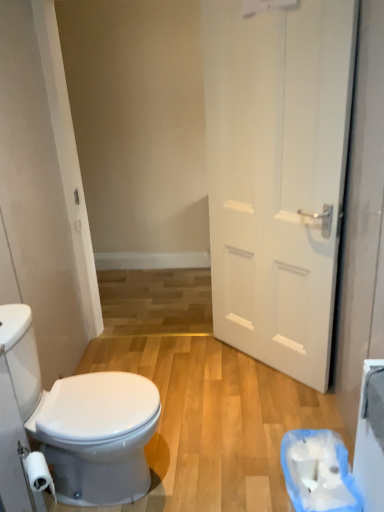
Question: From the image's perspective, is white matte toilet paper at lower left, arranged as the 2th toilet paper when viewed from the back, above white paper at lower right, acting as the first toilet paper starting from the right?

Choices:
 (A) no
 (B) yes

Answer: (B)

Question: Is white matte toilet paper at lower left, arranged as the 2th toilet paper when viewed from the back, outside of white paper at lower right, which is counted as the 1th toilet paper, starting from the back?

Choices:
 (A) yes
 (B) no

Answer: (A)

Question: From a real-world perspective, is white matte toilet paper at lower left, the first toilet paper when ordered from left to right, on top of white paper at lower right, acting as the first toilet paper starting from the right?

Choices:
 (A) yes
 (B) no

Answer: (A)

Question: Can you see white matte toilet paper at lower left, which appears as the 1th toilet paper when viewed from the front, touching white paper at lower right, acting as the first toilet paper starting from the right?

Choices:
 (A) no
 (B) yes

Answer: (A)

Question: Considering the relative sizes of white matte toilet paper at lower left, arranged as the 2th toilet paper when viewed from the back, and white paper at lower right, acting as the first toilet paper starting from the right, in the image provided, is white matte toilet paper at lower left, arranged as the 2th toilet paper when viewed from the back, bigger than white paper at lower right, acting as the first toilet paper starting from the right,?

Choices:
 (A) no
 (B) yes

Answer: (A)

Question: Does white matte toilet paper at lower left, arranged as the 2th toilet paper when viewed from the back, have a lesser width compared to white paper at lower right, acting as the first toilet paper starting from the right?

Choices:
 (A) no
 (B) yes

Answer: (B)

Question: Considering the relative positions of white matte door at right and white paper at lower right, which is counted as the 1th toilet paper, starting from the back, in the image provided, is white matte door at right to the right of white paper at lower right, which is counted as the 1th toilet paper, starting from the back, from the viewer's perspective?

Choices:
 (A) no
 (B) yes

Answer: (A)

Question: Considering the relative sizes of white matte door at right and white paper at lower right, the 2th toilet paper positioned from the left, in the image provided, is white matte door at right bigger than white paper at lower right, the 2th toilet paper positioned from the left,?

Choices:
 (A) yes
 (B) no

Answer: (A)

Question: Can you confirm if white matte door at right is taller than white paper at lower right, which is counted as the 1th toilet paper, starting from the back?

Choices:
 (A) no
 (B) yes

Answer: (B)

Question: Considering the relative sizes of white matte door at right and white paper at lower right, which is counted as the 1th toilet paper, starting from the back, in the image provided, is white matte door at right smaller than white paper at lower right, which is counted as the 1th toilet paper, starting from the back,?

Choices:
 (A) no
 (B) yes

Answer: (A)

Question: Is white matte door at right shorter than white paper at lower right, the 2th toilet paper positioned from the left?

Choices:
 (A) no
 (B) yes

Answer: (A)

Question: Is white matte door at right aimed at white paper at lower right, which is counted as the 1th toilet paper, starting from the back?

Choices:
 (A) no
 (B) yes

Answer: (A)

Question: Is white matte toilet paper at lower left, which appears as the 1th toilet paper when viewed from the front, taller than white glossy bidet at lower left?

Choices:
 (A) yes
 (B) no

Answer: (B)